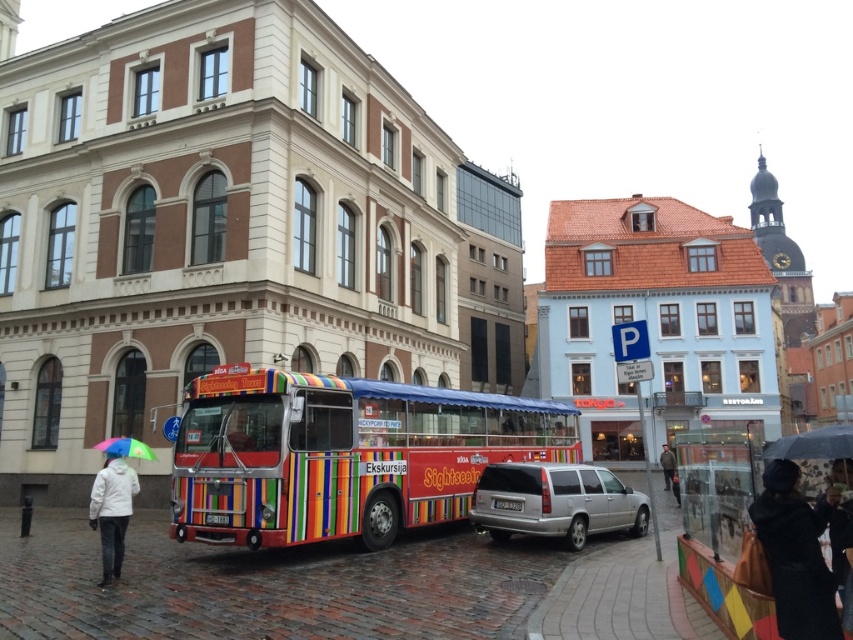
Question: In this image, where is rainbow striped decker bus at center located relative to transparent plastic umbrella at lower right?

Choices:
 (A) left
 (B) right

Answer: (A)

Question: Which object is farther from the camera taking this photo?

Choices:
 (A) rainbow striped decker bus at center
 (B) transparent plastic umbrella at lower right
 (C) white matte jacket at lower left

Answer: (A)

Question: Which point appears farthest from the camera in this image?

Choices:
 (A) (120, 451)
 (B) (824, 429)
 (C) (781, 461)

Answer: (A)

Question: Estimate the real-world distances between objects in this image. Which object is farther from the white matte jacket at lower left?

Choices:
 (A) black leather coat at lower right
 (B) transparent plastic umbrella at lower right

Answer: (B)

Question: Is black leather coat at lower right closer to the viewer compared to transparent plastic umbrella at lower right?

Choices:
 (A) no
 (B) yes

Answer: (B)

Question: Does white matte jacket at lower left have a greater width compared to rainbow striped umbrella at lower left?

Choices:
 (A) yes
 (B) no

Answer: (A)